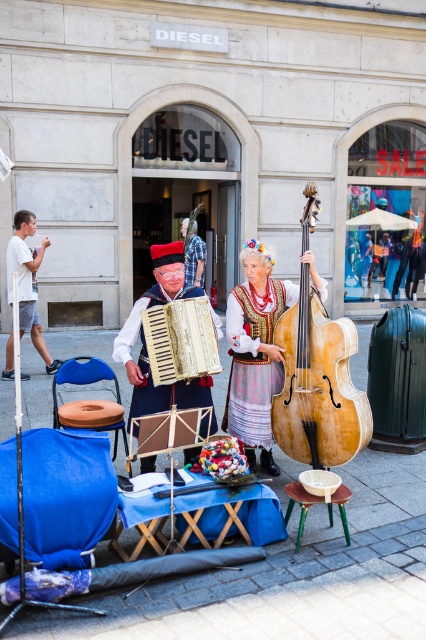
Which is more to the left, wooden double bass at center or wooden textured accordion at center?

Positioned to the left is wooden textured accordion at center.

Between wooden double bass at center and wooden textured accordion at center, which one appears on the right side from the viewer's perspective?

wooden double bass at center

The image size is (426, 640). I want to click on wooden double bass at center, so click(255, 353).

Is light brown wooden cello at center thinner than green wooden stool at lower center?

No, light brown wooden cello at center is not thinner than green wooden stool at lower center.

Which is below, light brown wooden cello at center or green wooden stool at lower center?

green wooden stool at lower center

At what (x,y) coordinates should I click in order to perform the action: click on light brown wooden cello at center. Please return your answer as a coordinate pair (x, y). This screenshot has width=426, height=640. Looking at the image, I should click on (317, 385).

Image resolution: width=426 pixels, height=640 pixels. What are the coordinates of `light brown wooden cello at center` in the screenshot? It's located at (317, 385).

Is embroidered cotton dress at center bigger than matte beige accordion at center?

Incorrect, embroidered cotton dress at center is not larger than matte beige accordion at center.

Is embroidered cotton dress at center closer to camera compared to matte beige accordion at center?

No, embroidered cotton dress at center is behind matte beige accordion at center.

Which is behind, point (239, 346) or point (170, 269)?

The point (239, 346) is behind.

Where is `embroidered cotton dress at center`? This screenshot has width=426, height=640. embroidered cotton dress at center is located at coordinates 253,364.